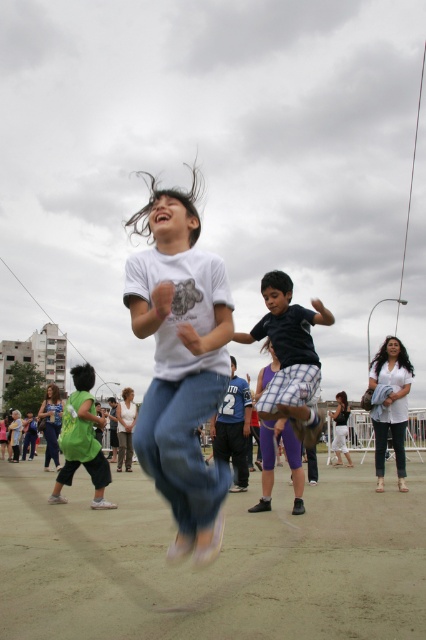
Between green fabric shirt at lower left and white cotton shirt at lower right, which one is positioned higher?

Positioned higher is white cotton shirt at lower right.

Describe the element at coordinates (81, 440) in the screenshot. This screenshot has width=426, height=640. I see `green fabric shirt at lower left` at that location.

Locate an element on the screen. This screenshot has width=426, height=640. green fabric shirt at lower left is located at coordinates [81, 440].

Between black cotton shirt at center and green fabric shirt at lower left, which one has less height?

With less height is green fabric shirt at lower left.

Can you confirm if black cotton shirt at center is positioned below green fabric shirt at lower left?

Incorrect, black cotton shirt at center is not positioned below green fabric shirt at lower left.

In order to click on black cotton shirt at center in this screenshot , I will do `click(290, 355)`.

The height and width of the screenshot is (640, 426). What are the coordinates of `black cotton shirt at center` in the screenshot? It's located at (290, 355).

Does point (175, 400) come closer to viewer compared to point (397, 371)?

Yes, it is in front of point (397, 371).

Who is higher up, white cotton t-shirt at center or white cotton shirt at lower right?

white cotton t-shirt at center is above.

Locate an element on the screen. white cotton t-shirt at center is located at coordinates (181, 362).

What are the coordinates of `white cotton t-shirt at center` in the screenshot? It's located at (x=181, y=362).